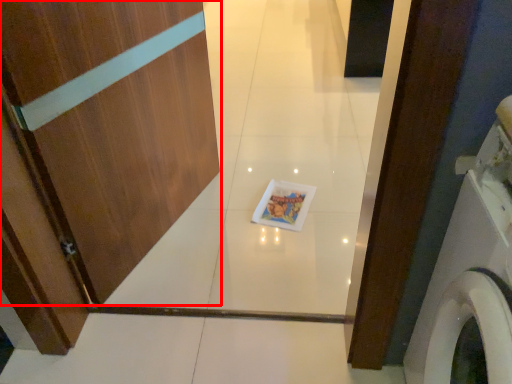
Question: From the image's perspective, what is the correct spatial positioning of door (annotated by the red box) in reference to washing machine?

Choices:
 (A) below
 (B) above

Answer: (B)